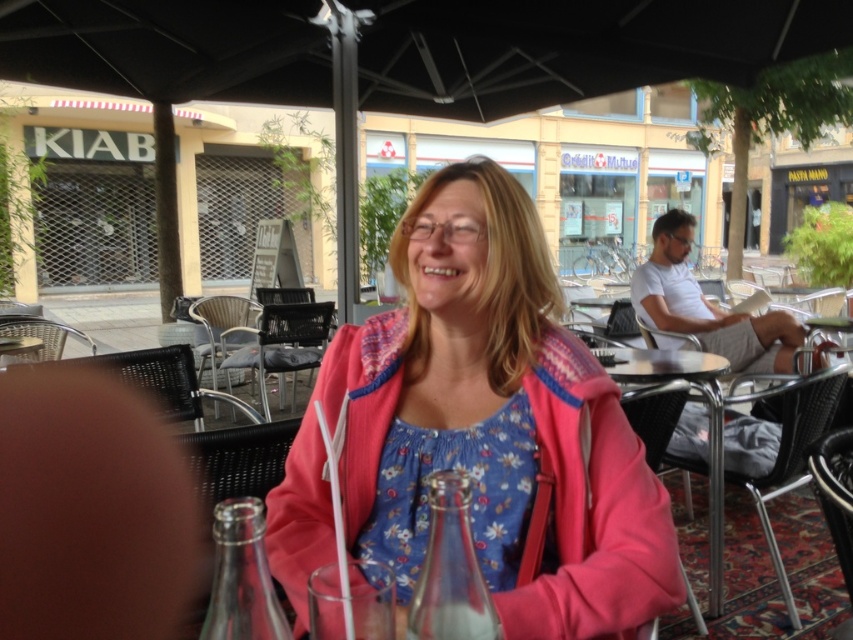
Which is more to the right, pink fleece jacket at center or metallic silver table at center?

metallic silver table at center

Consider the image. Measure the distance between point [488,580] and camera.

A distance of 37.30 inches exists between point [488,580] and camera.

This screenshot has height=640, width=853. I want to click on pink fleece jacket at center, so click(x=496, y=422).

Image resolution: width=853 pixels, height=640 pixels. What are the coordinates of `pink fleece jacket at center` in the screenshot? It's located at pyautogui.click(x=496, y=422).